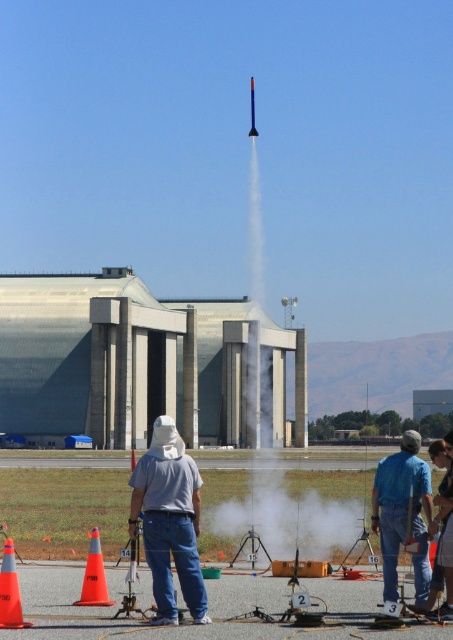
You are a photographer trying to capture the rocket launch. You have a camera with a zoom lens that can focus on objects up to 10 meters away. The blue denim jeans at center and the blue glossy rocket at center are both in your viewfinder. Which object should you zoom in on to ensure it is in focus and clear?

The blue denim jeans at center has a smaller size compared to the blue glossy rocket at center, so you should zoom in on the blue denim jeans at center to ensure it is in focus and clear since it is closer and smaller in the frame.

You are standing at the center of the image. Which direction should you move to reach the concrete building at center?

You are already at the center of the image where the concrete building at center is located, so no movement is needed.

You are a drone operator who needs to fly a drone from the orange plastic traffic cone at lower left to the concrete building at center. The drone has a maximum range of 120 meters. Can you safely complete the flight without exceeding the drone range limit?

The concrete building at center and orange plastic traffic cone at lower left are 119.42 meters apart. Since the distance is less than the drone range of 120 meters, the drone can safely complete the flight without exceeding the range limit.